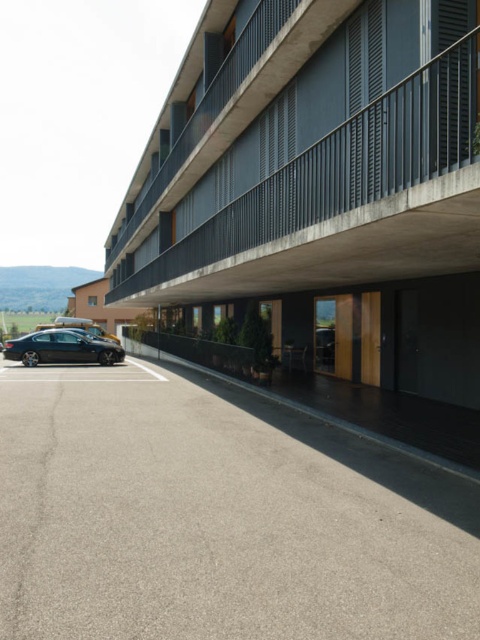
Question: Is gray asphalt parking lot at lower left to the right of shiny black sedan at lower left from the viewer's perspective?

Choices:
 (A) yes
 (B) no

Answer: (A)

Question: Which object is the farthest from the gray asphalt parking lot at lower left?

Choices:
 (A) matte black building at center
 (B) shiny black sedan at lower left

Answer: (B)

Question: Is matte black building at center to the right of shiny black sedan at lower left from the viewer's perspective?

Choices:
 (A) no
 (B) yes

Answer: (B)

Question: Which point is farther from the camera taking this photo?

Choices:
 (A) (87, 339)
 (B) (478, 621)

Answer: (A)

Question: Which point appears closest to the camera in this image?

Choices:
 (A) (59, 577)
 (B) (68, 332)
 (C) (249, 264)

Answer: (A)

Question: Is matte black building at center thinner than shiny black sedan at lower left?

Choices:
 (A) no
 (B) yes

Answer: (A)